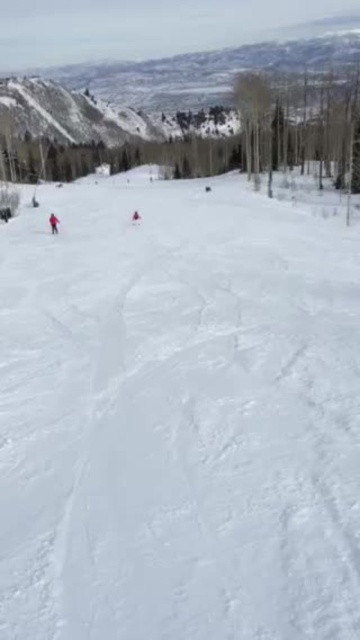
You are a skier planning to slide down the slope. You see the white powdery snow at center and the matte red snowsuit at left. Which object is lower in elevation?

The white powdery snow at center is below the matte red snowsuit at left, so the white powdery snow at center is lower in elevation.

You are a photographer trying to capture a photo of the matte red snowsuit at left and the white powdery snow at center. Since you want the snowsuit to stand out clearly against the snow, which object should you position closer to the camera to ensure visibility?

To ensure the matte red snowsuit at left stands out, position it closer to the camera since the white powdery snow at center is taller than the matte red snowsuit at left, making the snowsuit appear smaller if placed further away.